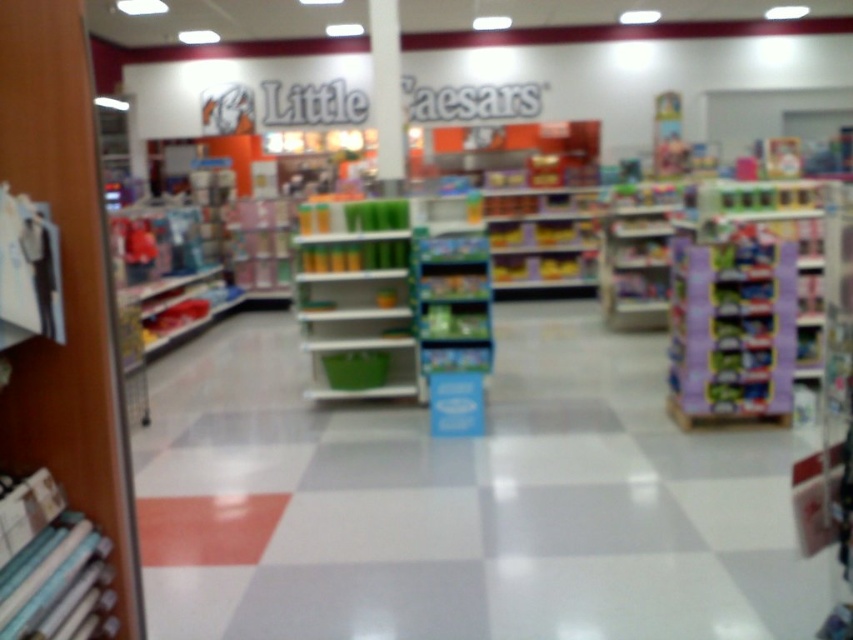
Who is lower down, purple cardboard candy at right or white glossy pillar at center?

purple cardboard candy at right is lower down.

Is point (721, 317) positioned in front of point (399, 99)?

Yes, it is.

You are a GUI agent. You are given a task and a screenshot of the screen. Output one action in this format:
    pyautogui.click(x=<x>, y=<y>)
    Task: Click on the purple cardboard candy at right
    
    Given the screenshot: What is the action you would take?
    pyautogui.click(x=730, y=328)

What are the coordinates of `purple cardboard candy at right` in the screenshot? It's located at (730, 328).

Does white glossy floor at center have a greater height compared to green plastic shelves at center?

In fact, white glossy floor at center may be shorter than green plastic shelves at center.

In order to click on white glossy floor at center in this screenshot , I will do `click(462, 500)`.

Between white glossy floor at center and purple cardboard candy at right, which one is positioned higher?

purple cardboard candy at right is higher up.

Measure the distance between white glossy floor at center and camera.

A distance of 4.00 meters exists between white glossy floor at center and camera.

This screenshot has height=640, width=853. I want to click on white glossy floor at center, so click(x=462, y=500).